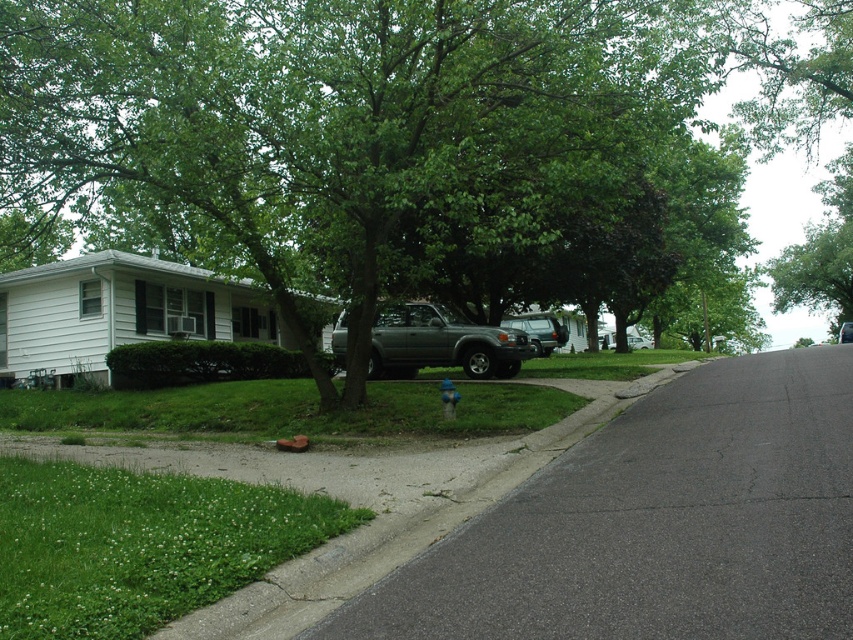
Question: Which point appears closest to the camera in this image?

Choices:
 (A) (397, 516)
 (B) (529, 330)

Answer: (A)

Question: Does green leafy tree at center come behind gray concrete curb at lower left?

Choices:
 (A) yes
 (B) no

Answer: (A)

Question: Which of the following is the closest to the observer?

Choices:
 (A) green leafy tree at center
 (B) satin gray suv at center

Answer: (A)

Question: Does green leafy tree at center have a greater width compared to metallic gray suv at center?

Choices:
 (A) no
 (B) yes

Answer: (B)

Question: Is green leafy tree at center further to camera compared to metallic gray suv at center?

Choices:
 (A) yes
 (B) no

Answer: (B)

Question: Which point is farther from the camera taking this photo?

Choices:
 (A) (502, 360)
 (B) (347, 579)

Answer: (A)